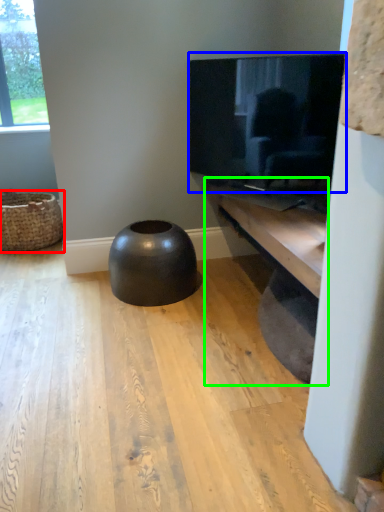
Question: Which is nearer to the basket (highlighted by a red box)? television (highlighted by a blue box) or shelf (highlighted by a green box).

Choices:
 (A) television
 (B) shelf

Answer: (A)